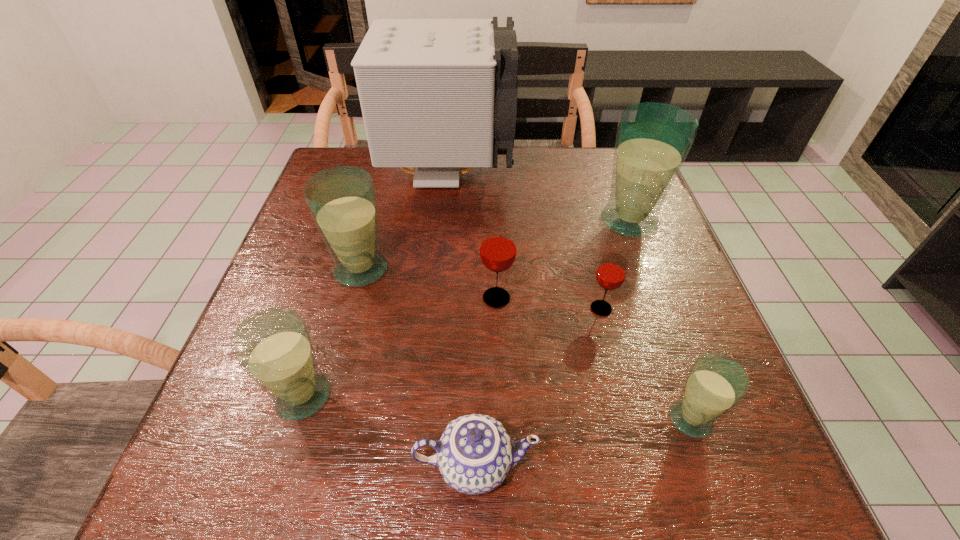
You are a GUI agent. You are given a task and a screenshot of the screen. Output one action in this format:
    pyautogui.click(x=<x>, y=<y>)
    Task: Click on the right red glass
    Image resolution: width=960 pixels, height=540 pixels.
    Given the screenshot: What is the action you would take?
    pyautogui.click(x=611, y=272)

This screenshot has height=540, width=960. I want to click on the smallest blue glass, so click(x=715, y=384).

I want to click on blue chinaware, so [474, 454].

The height and width of the screenshot is (540, 960). Find the location of `chinaware`. chinaware is located at coordinates (474, 454).

Image resolution: width=960 pixels, height=540 pixels. Find the location of `vacant space located 0.360m on the front of the fan`. vacant space located 0.360m on the front of the fan is located at coordinates (437, 314).

Locate an element on the screen. This screenshot has width=960, height=540. vacant space located 0.240m on the back of the biggest blue glass is located at coordinates (604, 154).

Locate an element on the screen. This screenshot has height=540, width=960. free spot located 0.180m on the front of the fifth shortest glass is located at coordinates (336, 365).

Locate an element on the screen. vacant space located on the left of the fourth glass from right to left is located at coordinates (321, 298).

Locate an element on the screen. vacant space situated 0.150m on the back of the third biggest blue glass is located at coordinates (330, 307).

The width and height of the screenshot is (960, 540). In order to click on vacant space located 0.300m on the front of the smaller red glass in this screenshot , I will do `click(641, 473)`.